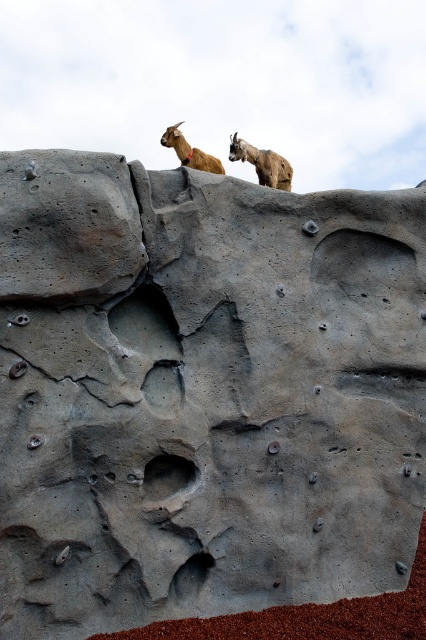
You are standing at the base of the climbing wall and want to throw a treat to the brown woolen goat at upper center. If the treat can travel in a straight line up to 10 meters, will it reach the goat?

The 2D location of brown woolen goat at upper center is at point (x=262, y=163). Assuming the coordinates are normalized between 0 and 1, the distance would be sqrt. Since the treat can travel up to 10 meters, it will easily reach the brown woolen goat at upper center.

You are a climber trying to reach the top of the climbing wall. You see two points marked on the wall. Which point is closer to you, point (262, 173) or point (178, 140)?

Point (262, 173) is further to the viewer than point (178, 140), so point (178, 140) is closer to you.